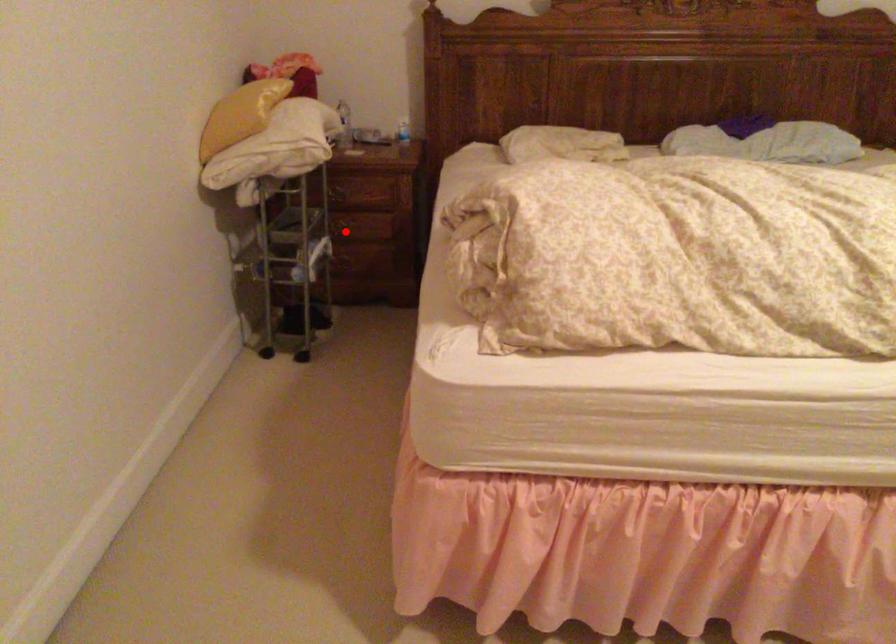
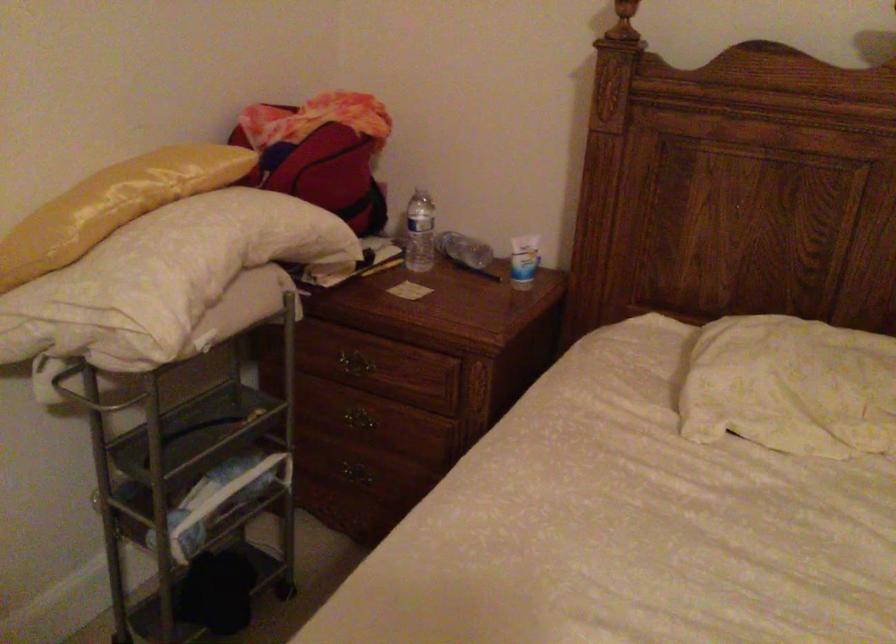
Locate, in the second image, the point that corresponds to the highlighted location in the first image.

(357, 426)